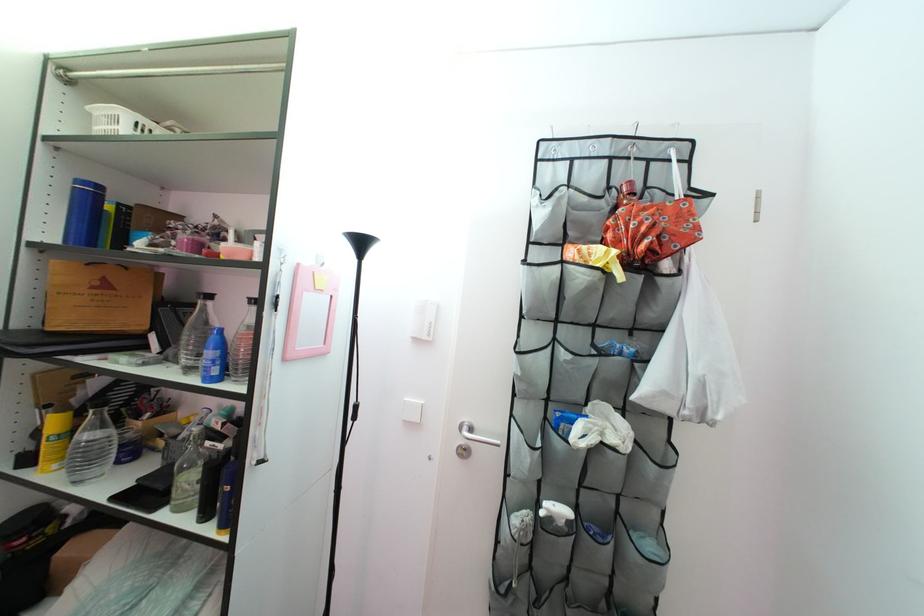
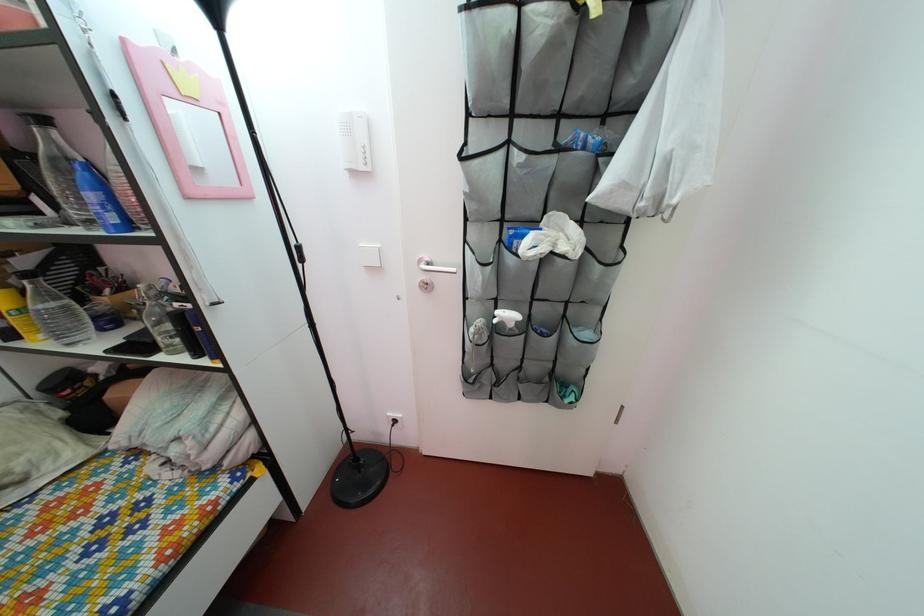
Locate, in the second image, the point that corresponds to (169,445) in the first image.

(140, 315)